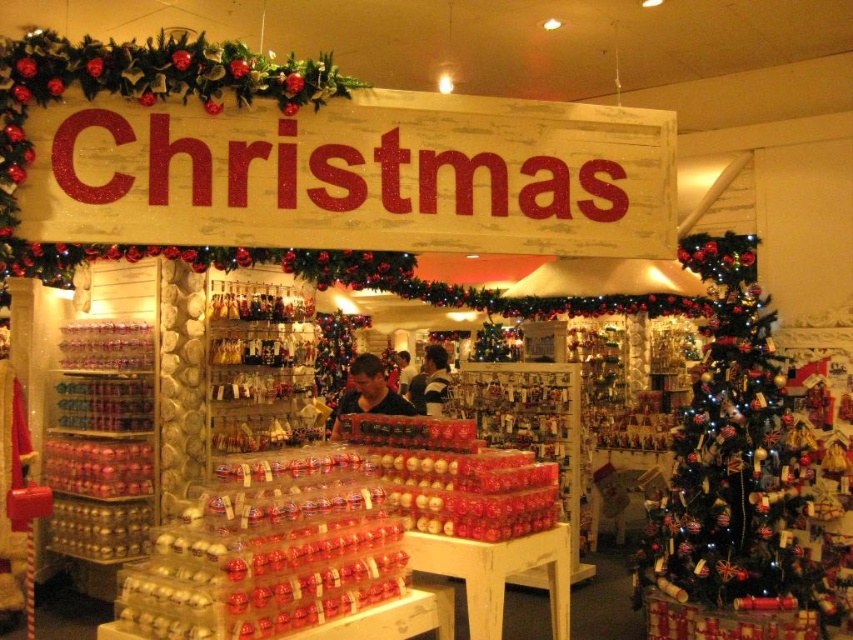
Which of these two, shiny metallic ornament at center or matte black shirt at center, stands shorter?

Standing shorter between the two is matte black shirt at center.

Does shiny metallic ornament at center have a smaller size compared to matte black shirt at center?

No.

What do you see at coordinates (733, 480) in the screenshot? The width and height of the screenshot is (853, 640). I see `shiny metallic ornament at center` at bounding box center [733, 480].

This screenshot has height=640, width=853. I want to click on shiny metallic ornament at center, so click(x=733, y=480).